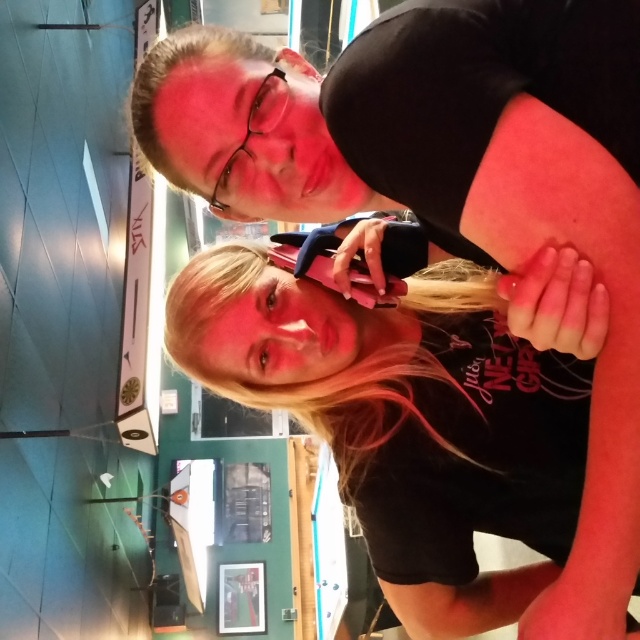
Based on the scene description, where is the point located at coordinates (332, 371)?

The point at coordinates (332, 371) corresponds to the blonde hair at center.

You are standing in a room where a person is holding a smartphone. There is a point marked at coordinates point (563, 435). Can you reach this point with your hand if you are 5 feet tall?

The point (563, 435) is 34.18 inches away from the viewer. Since 5 feet is 60 inches, you are 60 inches tall, so you can easily reach 34.18 inches.